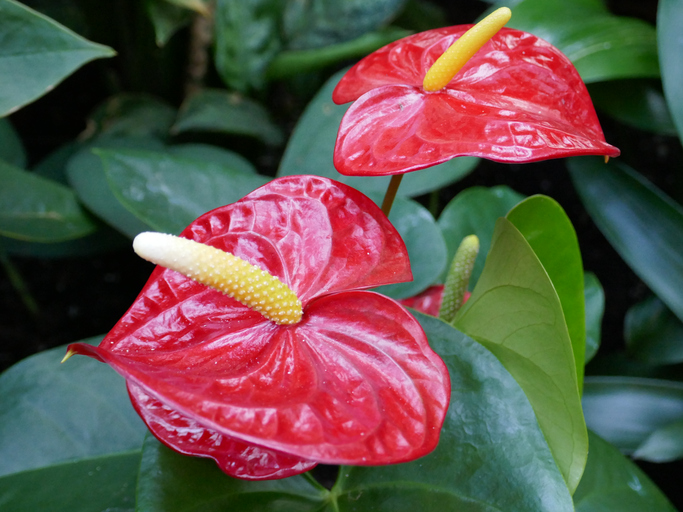
Locate an element on the screen. Image resolution: width=683 pixels, height=512 pixels. right corner is located at coordinates (673, 224).